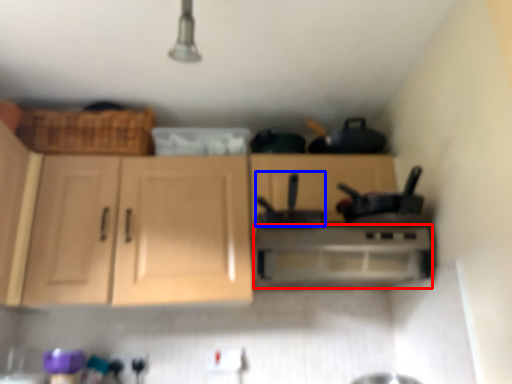
Question: Which object appears closest to the camera in this image, home appliance (highlighted by a red box) or appliance (highlighted by a blue box)?

Choices:
 (A) home appliance
 (B) appliance

Answer: (B)